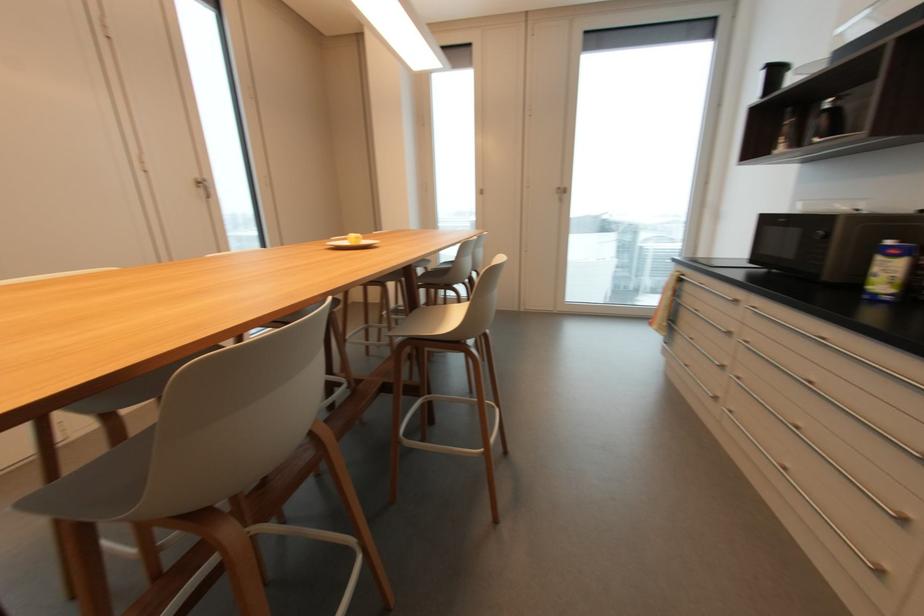
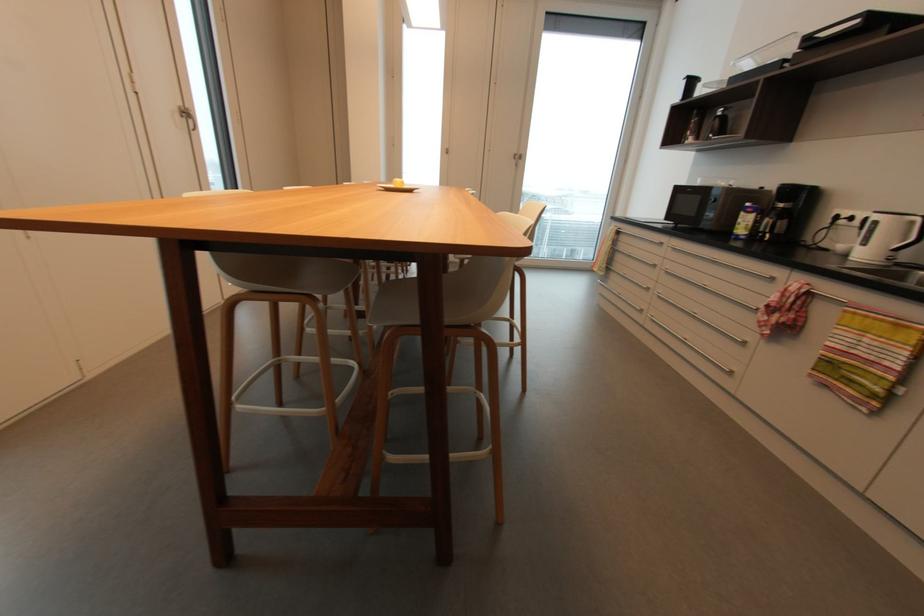
Question: The camera is either moving clockwise (left) or counter-clockwise (right) around the object. The first image is from the beginning of the video and the second image is from the end. Is the camera moving left or right when shooting the video?

Choices:
 (A) Left
 (B) Right

Answer: (A)